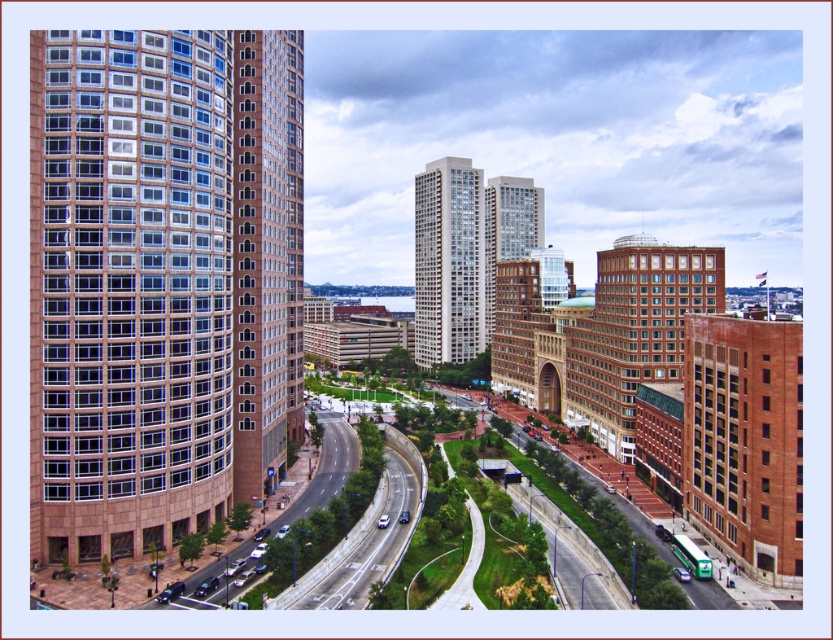
Question: Is brick building at lower right positioned before matte glass building at center?

Choices:
 (A) yes
 (B) no

Answer: (A)

Question: Estimate the real-world distances between objects in this image. Which object is closer to the smooth asphalt highway at lower left?

Choices:
 (A) brick textured building at center right
 (B) brick building at lower right
 (C) glassy reflective skyscraper at center
 (D) brown glassy building at left

Answer: (D)

Question: Which object is farther from the camera taking this photo?

Choices:
 (A) brown glassy building at left
 (B) brick building at lower right
 (C) glassy reflective skyscraper at center

Answer: (C)

Question: Where is brick textured building at center right located in relation to glassy reflective skyscraper at center in the image?

Choices:
 (A) above
 (B) below

Answer: (B)

Question: Does brown glassy building at left appear on the right side of smooth asphalt highway at lower left?

Choices:
 (A) yes
 (B) no

Answer: (B)

Question: Which of the following is the closest to the observer?

Choices:
 (A) smooth asphalt highway at lower left
 (B) matte glass building at center
 (C) brown brick building at left

Answer: (A)